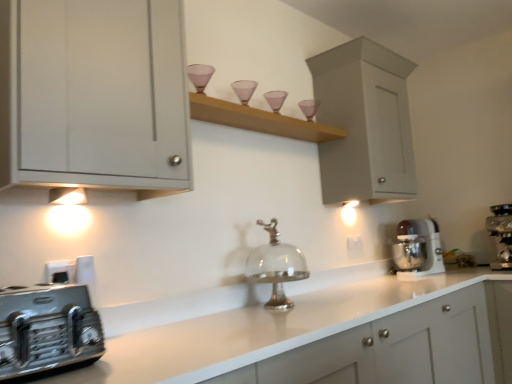
Question: Is white plastic stand mixer at right, the first home appliance from the back, not inside metallic silver toaster at lower left, acting as the first home appliance starting from the left?

Choices:
 (A) no
 (B) yes

Answer: (B)

Question: From the image's perspective, is white plastic stand mixer at right, which is the 2th home appliance from left to right, located above metallic silver toaster at lower left, acting as the first home appliance starting from the left?

Choices:
 (A) yes
 (B) no

Answer: (B)

Question: Can you confirm if white plastic stand mixer at right, which is the 2th home appliance from left to right, is smaller than metallic silver toaster at lower left, the 1th home appliance from the front?

Choices:
 (A) no
 (B) yes

Answer: (A)

Question: Is the position of white plastic stand mixer at right, which is the 2th home appliance from right to left, less distant than that of metallic silver toaster at lower left, the 1th home appliance from the front?

Choices:
 (A) yes
 (B) no

Answer: (B)

Question: Is metallic silver toaster at lower left, which is the third home appliance from back to front, completely or partially inside white plastic stand mixer at right, which is the 2th home appliance from right to left?

Choices:
 (A) no
 (B) yes

Answer: (A)

Question: In terms of height, does white plastic electric outlet at center look taller or shorter compared to white plastic stand mixer at right, which is the 2th home appliance from left to right?

Choices:
 (A) short
 (B) tall

Answer: (A)

Question: Based on their positions, is white plastic electric outlet at center located to the left or right of white plastic stand mixer at right, the 3th home appliance from the front?

Choices:
 (A) left
 (B) right

Answer: (A)

Question: Considering their positions, is white plastic electric outlet at center located in front of or behind white plastic stand mixer at right, which is the 2th home appliance from left to right?

Choices:
 (A) behind
 (B) front

Answer: (A)

Question: Looking at their shapes, would you say white plastic electric outlet at center is wider or thinner than white plastic stand mixer at right, the first home appliance from the back?

Choices:
 (A) thin
 (B) wide

Answer: (A)

Question: From the image's perspective, is white plastic electric outlet at center above or below metallic stainless steel coffee maker at right, the 1th home appliance from the right?

Choices:
 (A) above
 (B) below

Answer: (A)

Question: Looking at their shapes, would you say white plastic electric outlet at center is wider or thinner than metallic stainless steel coffee maker at right, positioned as the second home appliance in front-to-back order?

Choices:
 (A) thin
 (B) wide

Answer: (A)

Question: From a real-world perspective, is white plastic electric outlet at center above or below metallic stainless steel coffee maker at right, which is counted as the second home appliance, starting from the back?

Choices:
 (A) below
 (B) above

Answer: (B)

Question: Would you say white plastic electric outlet at center is inside or outside metallic stainless steel coffee maker at right, which is counted as the second home appliance, starting from the back?

Choices:
 (A) outside
 (B) inside

Answer: (A)

Question: Looking at the image, does metallic stainless steel coffee maker at right, which is the 3th home appliance from left to right, seem bigger or smaller compared to white plastic electric outlet at center?

Choices:
 (A) big
 (B) small

Answer: (A)

Question: From the image's perspective, is metallic stainless steel coffee maker at right, the 1th home appliance from the right, above or below white plastic electric outlet at center?

Choices:
 (A) below
 (B) above

Answer: (A)